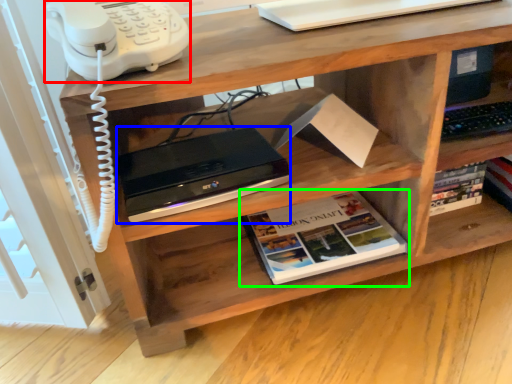
Question: Which object is the closest to the corded phone (highlighted by a red box)? Choose among these: computer (highlighted by a blue box) or book (highlighted by a green box).

Choices:
 (A) computer
 (B) book

Answer: (A)